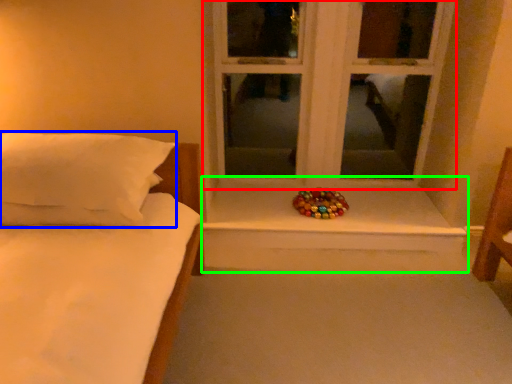
Question: Estimate the real-world distances between objects in this image. Which object is closer to window (highlighted by a red box), pillow (highlighted by a blue box) or window sill (highlighted by a green box)?

Choices:
 (A) pillow
 (B) window sill

Answer: (B)